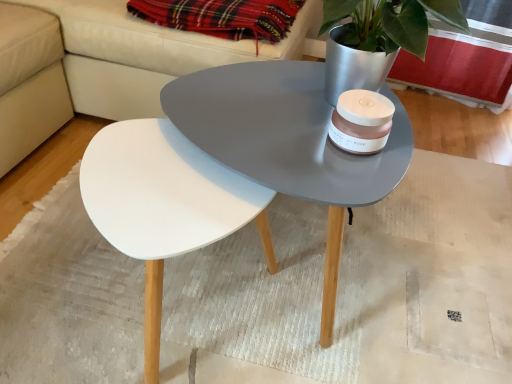
Question: From a real-world perspective, relative to plaid fabric at upper center, is white matte mat at center vertically above or below?

Choices:
 (A) above
 (B) below

Answer: (B)

Question: From their relative heights in the image, would you say white matte mat at center is taller or shorter than plaid fabric at upper center?

Choices:
 (A) tall
 (B) short

Answer: (B)

Question: Estimate the real-world distances between objects in this image. Which object is farther from the white matte mat at center?

Choices:
 (A) white leather couch at upper center
 (B) plaid fabric at upper center

Answer: (B)

Question: Based on their relative distances, which object is farther from the white matte mat at center?

Choices:
 (A) white leather couch at upper center
 (B) plaid fabric at upper center

Answer: (B)